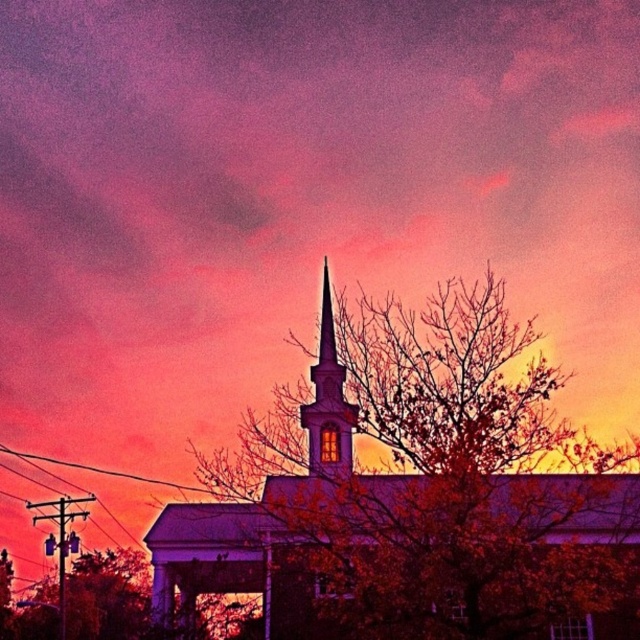
Does white stucco church at center have a lesser height compared to smooth white steeple at center?

In fact, white stucco church at center may be taller than smooth white steeple at center.

Which is more to the right, white stucco church at center or smooth white steeple at center?

white stucco church at center is more to the right.

Does point (193, 529) come behind point (307, 406)?

No, (193, 529) is in front of (307, 406).

You are a GUI agent. You are given a task and a screenshot of the screen. Output one action in this format:
    pyautogui.click(x=<x>, y=<y>)
    Task: Click on the white stucco church at center
    The width and height of the screenshot is (640, 640).
    Given the screenshot: What is the action you would take?
    pyautogui.click(x=288, y=516)